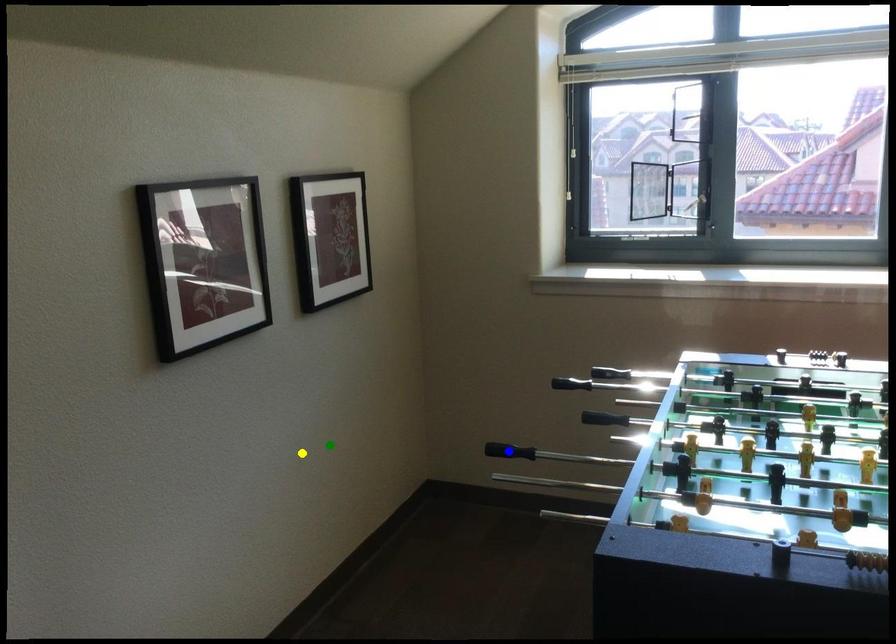
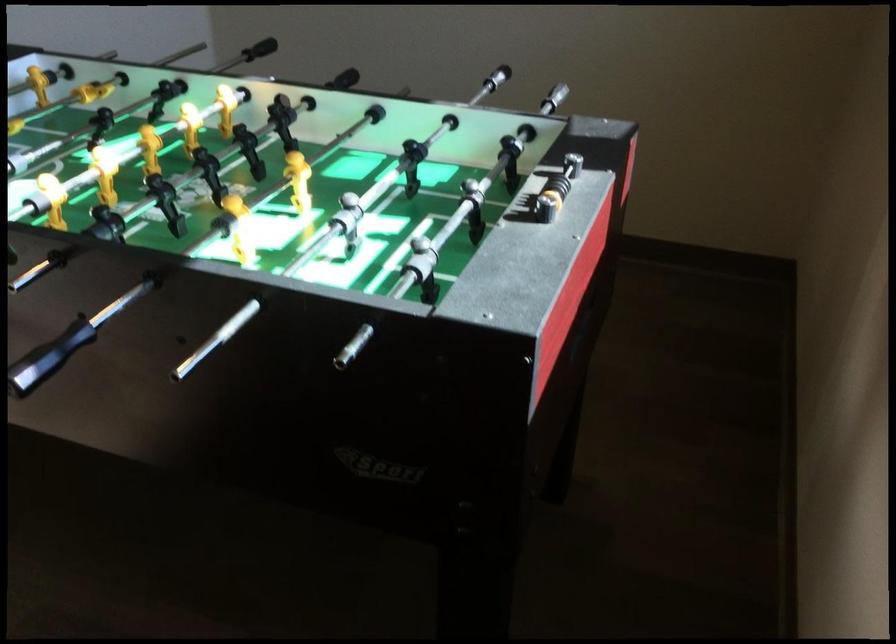
I am providing you with two images of the same scene from different viewpoints. Three points are marked in image1. Which point corresponds to a part or object that is occluded in image2?In image1, three points are marked. Which of them correspond to a part or object that is occluded in image2?Among the three points shown in image1, which one corresponds to a part or object that is no longer visible due to occlusion in image2?

blue point